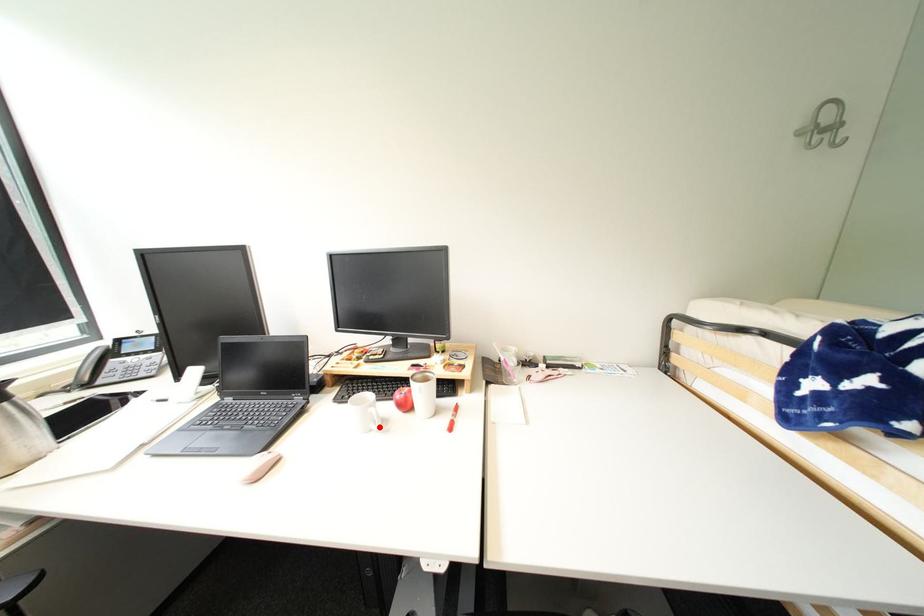
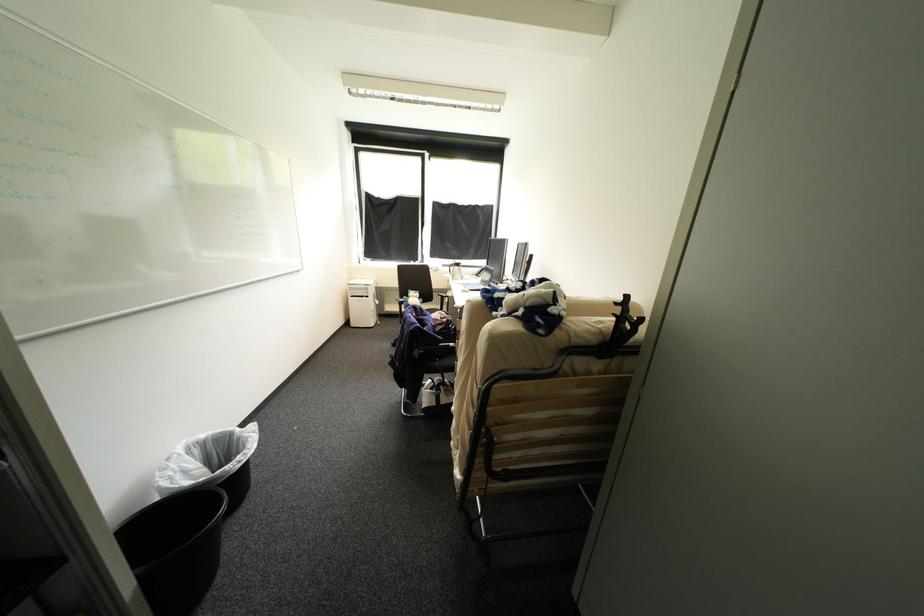
Question: I am providing you with two images of the same scene from different viewpoints. A red point is marked on the first image. At the location where the point appears in image 1, is it still visible in image 2?

Choices:
 (A) Yes
 (B) No

Answer: (B)